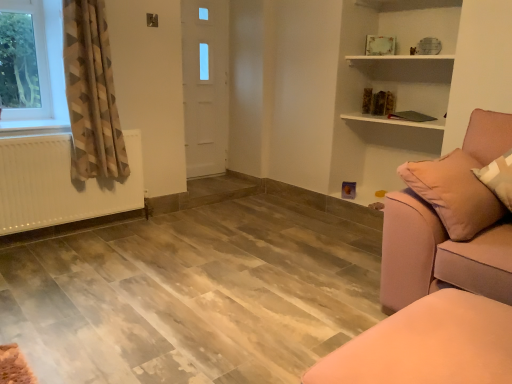
Question: Is white matte radiator at left wider or thinner than satin pink couch at right?

Choices:
 (A) wide
 (B) thin

Answer: (B)

Question: Is white matte radiator at left bigger or smaller than satin pink couch at right?

Choices:
 (A) big
 (B) small

Answer: (B)

Question: Based on their relative distances, which object is farther from the satin pink couch at right?

Choices:
 (A) geometric-patterned fabric curtain at left
 (B) white matte radiator at left
 (C) pink fabric ottoman at lower right

Answer: (B)

Question: Estimate the real-world distances between objects in this image. Which object is closer to the white matte radiator at left?

Choices:
 (A) satin pink couch at right
 (B) geometric-patterned fabric curtain at left
 (C) pink fabric ottoman at lower right

Answer: (B)